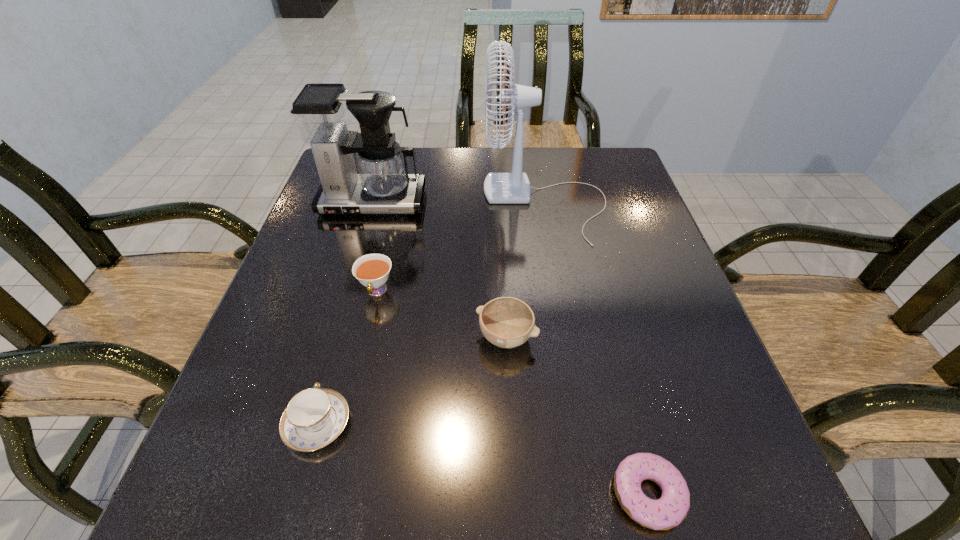
At what (x,y) coordinates should I click in order to perform the action: click on vacant region that satisfies the following two spatial constraints: 1. at the front of the coffee maker where the controls are located; 2. on the right side of the nearest object. Please return your answer as a coordinate pair (x, y). Looking at the image, I should click on (287, 494).